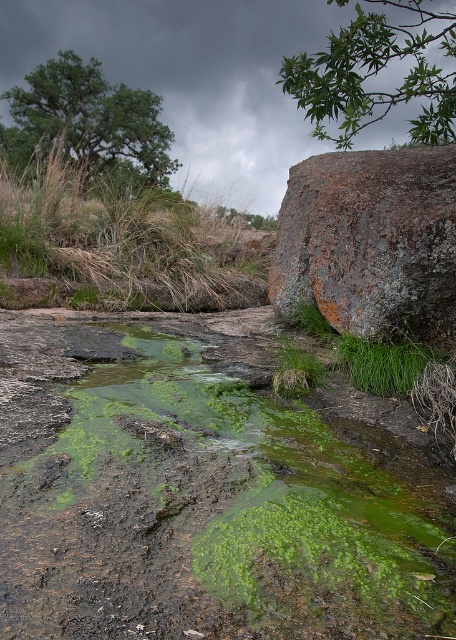
You are a hiker carrying a 1.5 meter wide tent. You want to set up camp near the stream. Can you place your tent between the green mossy rock at center and the green mossy algae at upper left without overlapping them?

The green mossy rock at center has a lesser width compared to green mossy algae at upper left. Since the tent is 1.5 meters wide, you need to ensure there is enough space between them. However, the description only provides relative width information, not the exact distance between the objects. Without knowing the actual distance, it is uncertain if the tent will fit. Please check the actual spacing between the green mossy rock at center and the green mossy algae at upper left.

You are a hiker who just arrived at the stream. You see a rusty rock at upper right and a green mossy algae at upper left. Which object is nearer to you?

The rusty rock at upper right is closer to the viewer than the green mossy algae at upper left.

You are standing at the edge of the stream and see a point marked at coordinates [212,516]. Based on the scene description, what object is located at that point?

The point at coordinates [212,516] corresponds to the green mossy rock at center.